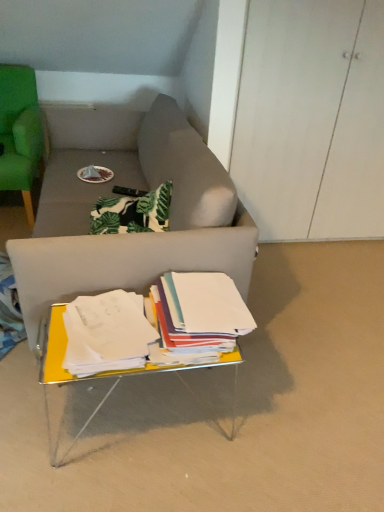
This screenshot has width=384, height=512. I want to click on free location above white paper at center, placed as the 2th paperback book when sorted from right to left (from a real-world perspective), so click(x=120, y=324).